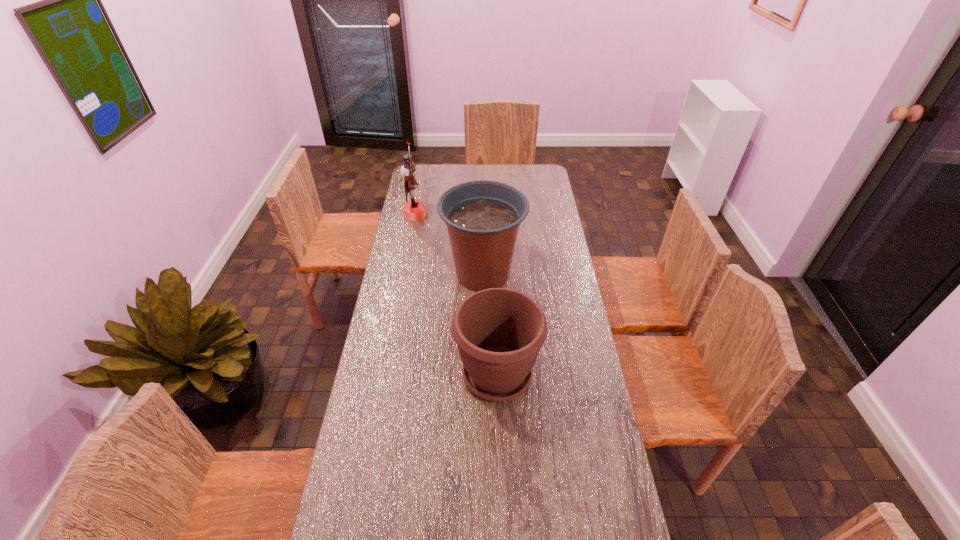
Where is `the leftmost object`? the leftmost object is located at coordinates (414, 210).

Locate an element on the screen. the farthest object is located at coordinates (414, 210).

The height and width of the screenshot is (540, 960). I want to click on the taller flowerpot, so click(483, 217).

Locate an element on the screen. This screenshot has height=540, width=960. the farther flowerpot is located at coordinates (483, 217).

The height and width of the screenshot is (540, 960). I want to click on the nearer flowerpot, so click(499, 332).

I want to click on the shortest object, so click(499, 332).

The height and width of the screenshot is (540, 960). I want to click on free point located 0.290m on the front-facing side of the nutcracker, so click(x=484, y=214).

In order to click on free space located on the right of the second farthest object in this screenshot , I will do (x=542, y=274).

Where is `vacant space located 0.160m on the right of the nearer flowerpot`? vacant space located 0.160m on the right of the nearer flowerpot is located at coordinates [587, 374].

You are a GUI agent. You are given a task and a screenshot of the screen. Output one action in this format:
    pyautogui.click(x=<x>, y=<y>)
    Task: Click on the object positioned at the left edge
    The width and height of the screenshot is (960, 540).
    Given the screenshot: What is the action you would take?
    point(414,210)